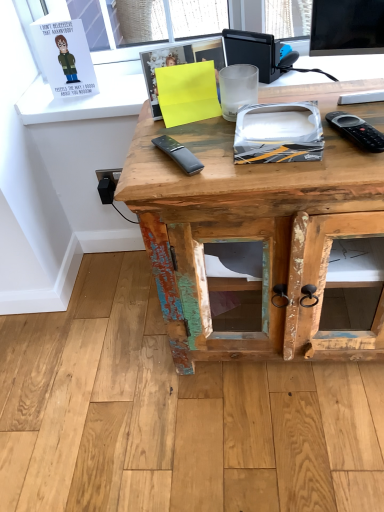
Question: In the image, is matte paper card at upper left, acting as the second book starting from the front, positioned in front of or behind yellow paper at center, the 1th book viewed from the front?

Choices:
 (A) behind
 (B) front

Answer: (A)

Question: Is matte paper card at upper left, which is counted as the 1th book, starting from the top, inside or outside of yellow paper at center, the second book viewed from the left?

Choices:
 (A) outside
 (B) inside

Answer: (A)

Question: Which object is the closest to the matte paper card at upper left, the 1th book from the left?

Choices:
 (A) rustic wood desk at center
 (B) yellow paper at center, positioned as the second book in top-to-bottom order

Answer: (B)

Question: Estimate the real-world distances between objects in this image. Which object is farther from the yellow paper at center, acting as the first book starting from the bottom?

Choices:
 (A) rustic wood desk at center
 (B) matte paper card at upper left, acting as the second book starting from the front

Answer: (B)